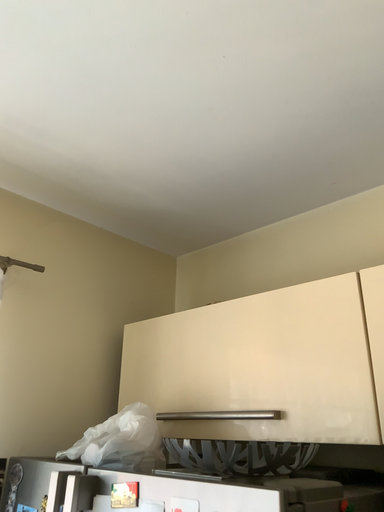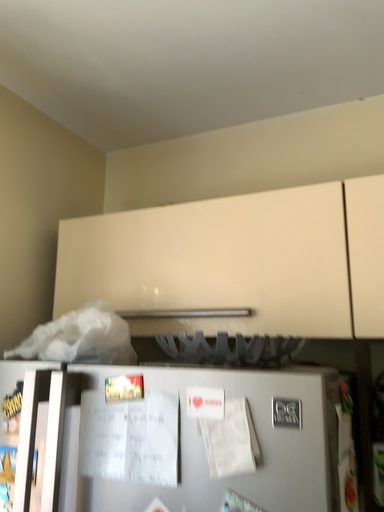
Question: Which way did the camera rotate in the video?

Choices:
 (A) rotated right
 (B) rotated left

Answer: (A)